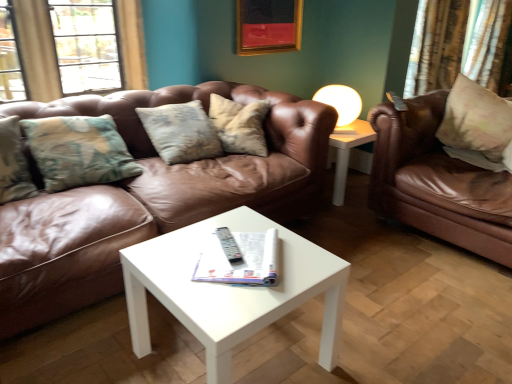
What is the approximate height of white glossy coffee table at center?

It is 17.82 inches.

Locate an element on the screen. This screenshot has height=384, width=512. brown leather couch at center, the 1th studio couch in the left-to-right sequence is located at coordinates (148, 198).

How much space does brown leather couch at center, the 1th studio couch in the left-to-right sequence, occupy horizontally?

The width of brown leather couch at center, the 1th studio couch in the left-to-right sequence, is 38.79 inches.

Locate an element on the screen. The height and width of the screenshot is (384, 512). brown leather couch at right, the 2th studio couch in the left-to-right sequence is located at coordinates (437, 181).

This screenshot has width=512, height=384. Find the location of `white paper magazine at center`. white paper magazine at center is located at coordinates (241, 260).

Locate an element on the screen. The width and height of the screenshot is (512, 384). white matte lampshade at upper center is located at coordinates (341, 105).

Locate an element on the screen. white glossy coffee table at center is located at coordinates (230, 290).

Considering the sizes of white glossy coffee table at center and brown leather couch at center, the 1th studio couch in the left-to-right sequence, in the image, is white glossy coffee table at center bigger or smaller than brown leather couch at center, the 1th studio couch in the left-to-right sequence,?

Considering their sizes, white glossy coffee table at center takes up less space than brown leather couch at center, the 1th studio couch in the left-to-right sequence.

Considering the relative positions of white glossy coffee table at center and brown leather couch at center, the 1th studio couch in the left-to-right sequence, in the image provided, is white glossy coffee table at center behind brown leather couch at center, the 1th studio couch in the left-to-right sequence,?

No, it is in front of brown leather couch at center, the 1th studio couch in the left-to-right sequence.

Is white glossy coffee table at center positioned far away from brown leather couch at center, the 1th studio couch in the left-to-right sequence?

No, there isn't a large distance between white glossy coffee table at center and brown leather couch at center, the 1th studio couch in the left-to-right sequence.

Based on the photo, is brown leather couch at right, the 2th studio couch in the left-to-right sequence, inside the boundaries of black plastic remote at center, or outside?

brown leather couch at right, the 2th studio couch in the left-to-right sequence, is spatially situated outside black plastic remote at center.

Is brown leather couch at right, the 2th studio couch in the left-to-right sequence, positioned with its back to black plastic remote at center?

No.

Locate an element on the screen. The width and height of the screenshot is (512, 384). studio couch behind the black plastic remote at center is located at coordinates (437, 181).

Considering the relative sizes of white glossy coffee table at center and white paper magazine at center in the image provided, is white glossy coffee table at center smaller than white paper magazine at center?

No.

From the image's perspective, which object appears higher, white glossy coffee table at center or white paper magazine at center?

From the image's view, white paper magazine at center is above.

From a real-world perspective, is white glossy coffee table at center on top of white paper magazine at center?

No, from a real-world perspective, white glossy coffee table at center is not on top of white paper magazine at center.

Which is closer, (201, 222) or (262, 265)?

The point (262, 265) is closer.

From a real-world perspective, is brown leather couch at center, which is counted as the 2th studio couch, starting from the right, physically located above or below gold textured curtain at upper right?

From a real-world perspective, brown leather couch at center, which is counted as the 2th studio couch, starting from the right, is physically below gold textured curtain at upper right.

Which is correct: brown leather couch at center, which is counted as the 2th studio couch, starting from the right, is inside gold textured curtain at upper right, or outside of it?

brown leather couch at center, which is counted as the 2th studio couch, starting from the right, lies outside gold textured curtain at upper right.

From the picture: Considering the relative positions of brown leather couch at center, the 1th studio couch in the left-to-right sequence, and gold textured curtain at upper right in the image provided, is brown leather couch at center, the 1th studio couch in the left-to-right sequence, to the left of gold textured curtain at upper right from the viewer's perspective?

Yes, brown leather couch at center, the 1th studio couch in the left-to-right sequence, is to the left of gold textured curtain at upper right.

Does brown leather couch at center, the 1th studio couch in the left-to-right sequence, have a larger size compared to gold textured curtain at upper right?

Correct, brown leather couch at center, the 1th studio couch in the left-to-right sequence, is larger in size than gold textured curtain at upper right.

Does white matte lampshade at upper center turn towards white paper magazine at center?

No, white matte lampshade at upper center is not aimed at white paper magazine at center.

Looking at their sizes, would you say white matte lampshade at upper center is wider or thinner than white paper magazine at center?

Clearly, white matte lampshade at upper center has less width compared to white paper magazine at center.

Considering the relative sizes of white matte lampshade at upper center and white paper magazine at center in the image provided, is white matte lampshade at upper center taller than white paper magazine at center?

Yes.

Are white matte lampshade at upper center and white paper magazine at center beside each other?

There is a gap between white matte lampshade at upper center and white paper magazine at center.

Could you tell me if white matte lampshade at upper center is facing floral fabric pillow at right?

Yes, white matte lampshade at upper center is turned towards floral fabric pillow at right.

From a real-world perspective, does white matte lampshade at upper center sit lower than floral fabric pillow at right?

Yes, from a real-world perspective, white matte lampshade at upper center is under floral fabric pillow at right.

Based on the photo, between white matte lampshade at upper center and floral fabric pillow at right, which one has less height?

white matte lampshade at upper center.

Considering the positions of point (228, 258) and point (467, 157), is point (228, 258) closer or farther from the camera than point (467, 157)?

Point (228, 258) is closer to the camera than point (467, 157).

Which of these two, black plastic remote at center or floral fabric pillow at right, stands shorter?

With less height is black plastic remote at center.

From a real-world perspective, which object rests below the other?

black plastic remote at center is physically lower.

In the scene shown: From the image's perspective, which is above, black plastic remote at center or floral fabric pillow at right?

From the image's view, floral fabric pillow at right is above.

The height and width of the screenshot is (384, 512). I want to click on studio couch on the left of white glossy coffee table at center, so click(148, 198).

From the image's perspective, which studio couch is the 2nd one above the black plastic remote at center? Please provide its 2D coordinates.

[(437, 181)]

Considering their positions, is floral fabric pillow at right positioned further to gold textured curtain at upper right than white matte lampshade at upper center?

Result: The object further to gold textured curtain at upper right is white matte lampshade at upper center.

Based on their spatial positions, is white glossy coffee table at center or gold textured curtain at upper right closer to white paper magazine at center?

white glossy coffee table at center is closer to white paper magazine at center.

When comparing their distances from white matte lampshade at upper center, does white paper magazine at center or floral fabric pillow at right seem further?

The object further to white matte lampshade at upper center is white paper magazine at center.

Which object lies further to the anchor point brown leather couch at center, the 1th studio couch in the left-to-right sequence, gold textured curtain at upper right or white matte lampshade at upper center?

gold textured curtain at upper right is further to brown leather couch at center, the 1th studio couch in the left-to-right sequence.

Considering their positions, is gold textured curtain at upper right positioned closer to floral fabric pillow at right than brown leather couch at center, the 1th studio couch in the left-to-right sequence?

The object closer to floral fabric pillow at right is brown leather couch at center, the 1th studio couch in the left-to-right sequence.

Looking at the image, which one is located closer to white paper magazine at center, floral fabric pillow at right or black plastic remote at center?

The object closer to white paper magazine at center is black plastic remote at center.

When comparing their distances from white matte lampshade at upper center, does brown leather couch at right, the 1th studio couch viewed from the right, or brown leather couch at center, the 1th studio couch in the left-to-right sequence, seem closer?

brown leather couch at right, the 1th studio couch viewed from the right, is positioned closer to the anchor white matte lampshade at upper center.

When comparing their distances from brown leather couch at center, which is counted as the 2th studio couch, starting from the right, does floral fabric pillow at right or gold textured curtain at upper right seem closer?

floral fabric pillow at right.

This screenshot has width=512, height=384. Identify the location of remote situated between brown leather couch at center, which is counted as the 2th studio couch, starting from the right, and brown leather couch at right, the 2th studio couch in the left-to-right sequence, from left to right. (229, 245).

This screenshot has width=512, height=384. What are the coordinates of `pillow between brown leather couch at right, the 2th studio couch in the left-to-right sequence, and gold textured curtain at upper right from front to back` in the screenshot? It's located at (477, 126).

Find the location of a particular element. The width and height of the screenshot is (512, 384). lamp between black plastic remote at center and floral fabric pillow at right is located at coordinates (341, 105).

The height and width of the screenshot is (384, 512). I want to click on magazine between black plastic remote at center and floral fabric pillow at right in the horizontal direction, so click(x=241, y=260).